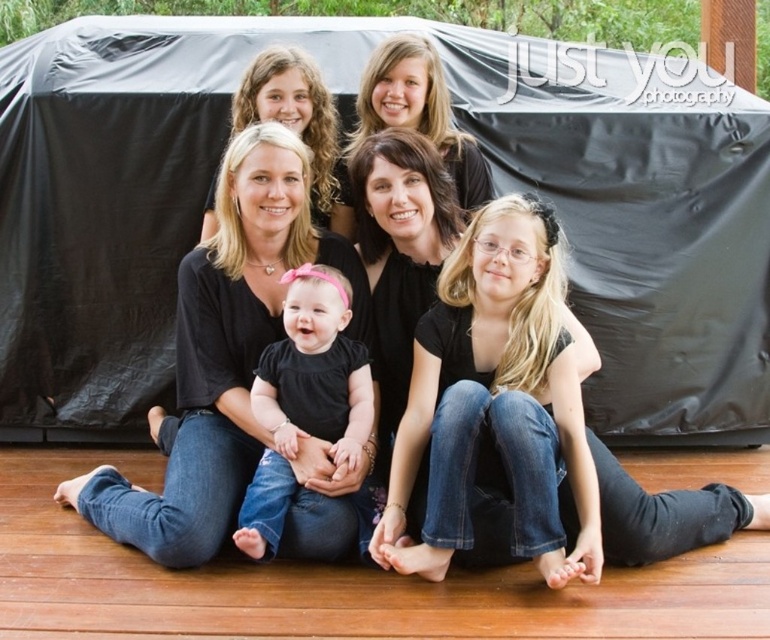
Question: Does blonde hair at center lie behind matte black shirt at upper center?

Choices:
 (A) no
 (B) yes

Answer: (A)

Question: Is black matte shirt at center in front of matte black shirt at upper center?

Choices:
 (A) no
 (B) yes

Answer: (B)

Question: Which object is positioned closest to the blonde hair at center?

Choices:
 (A) black matte shirt at center
 (B) matte black shirt at upper center
 (C) black matte dress at center

Answer: (C)

Question: Does black matte shirt at center appear over matte black shirt at upper center?

Choices:
 (A) no
 (B) yes

Answer: (A)

Question: Estimate the real-world distances between objects in this image. Which object is farther from the matte black shirt at upper center?

Choices:
 (A) black matte shirt at center
 (B) blonde hair at center

Answer: (B)

Question: Which point is farther from the camera taking this photo?

Choices:
 (A) (333, 456)
 (B) (439, 573)

Answer: (A)